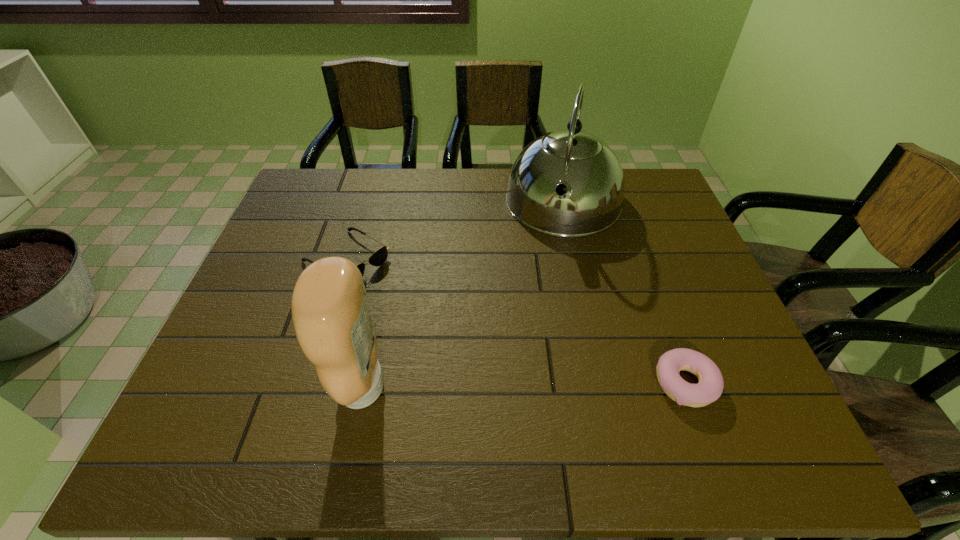
At what (x,y) coordinates should I click in order to perform the action: click on blank region between the kettle and the condiment. Please return your answer as a coordinate pair (x, y). Image resolution: width=960 pixels, height=540 pixels. Looking at the image, I should click on (462, 295).

Locate an element on the screen. The width and height of the screenshot is (960, 540). free spot between the condiment and the kettle is located at coordinates (462, 295).

Find the location of a particular element. vacant point located between the sunglasses and the doughnut is located at coordinates (516, 321).

The height and width of the screenshot is (540, 960). I want to click on free space between the kettle and the condiment, so click(462, 295).

This screenshot has height=540, width=960. Find the location of `vacant area that lies between the condiment and the doughnut`. vacant area that lies between the condiment and the doughnut is located at coordinates (523, 386).

Identify the location of blank region between the condiment and the kettle. The image size is (960, 540). coord(462,295).

Find the location of a particular element. This screenshot has height=540, width=960. vacant point located between the doughnut and the kettle is located at coordinates (624, 294).

You are a GUI agent. You are given a task and a screenshot of the screen. Output one action in this format:
    pyautogui.click(x=<x>, y=<y>)
    Task: Click on the object that stands as the second closest to the doughnut
    This screenshot has width=960, height=540.
    Given the screenshot: What is the action you would take?
    pyautogui.click(x=330, y=313)

Where is `object that is the third closest one to the sunglasses`? object that is the third closest one to the sunglasses is located at coordinates (709, 389).

At what (x,y) coordinates should I click in order to perform the action: click on vacant position in the image that satisfies the following two spatial constraints: 1. on the front side of the sunglasses; 2. on the label of the condiment. Please return your answer as a coordinate pair (x, y). The image size is (960, 540). Looking at the image, I should click on (307, 387).